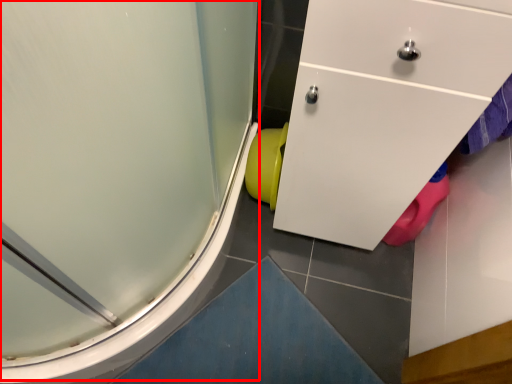
Question: From the image's perspective, considering the relative positions of shower door (annotated by the red box) and toilet bowl in the image provided, where is shower door (annotated by the red box) located with respect to the staircase?

Choices:
 (A) above
 (B) below

Answer: (A)